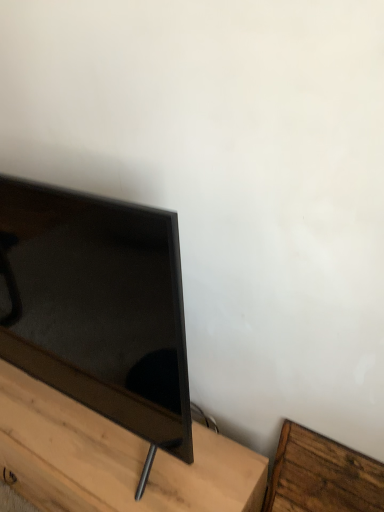
This screenshot has width=384, height=512. Describe the element at coordinates (322, 476) in the screenshot. I see `wooden bed frame at lower right, arranged as the second furniture when viewed from the left` at that location.

This screenshot has height=512, width=384. What do you see at coordinates (113, 459) in the screenshot?
I see `matte black tv stand at lower left, the 2th furniture in the right-to-left sequence` at bounding box center [113, 459].

Identify the location of matte black tv at left. This screenshot has width=384, height=512. (97, 306).

Is matte black tv at left outside of wooden bed frame at lower right, arranged as the second furniture when viewed from the left?

Absolutely, matte black tv at left is external to wooden bed frame at lower right, arranged as the second furniture when viewed from the left.

Is matte black tv at left placed right next to wooden bed frame at lower right, which is the 1th furniture from right to left?

No, matte black tv at left is not touching wooden bed frame at lower right, which is the 1th furniture from right to left.

How different are the orientations of matte black tv at left and wooden bed frame at lower right, which is the 1th furniture from right to left, in degrees?

They differ by 0.965 degrees in their facing directions.

Does matte black tv at left lie behind wooden bed frame at lower right, which is the 1th furniture from right to left?

No, the depth of matte black tv at left is less than that of wooden bed frame at lower right, which is the 1th furniture from right to left.

Based on the photo, can you tell me how much matte black tv stand at lower left, acting as the first furniture starting from the left, and matte black tv at left differ in facing direction?

The angular difference between matte black tv stand at lower left, acting as the first furniture starting from the left, and matte black tv at left is 0.0479 degrees.

Is matte black tv stand at lower left, the 2th furniture in the right-to-left sequence, situated inside matte black tv at left or outside?

matte black tv stand at lower left, the 2th furniture in the right-to-left sequence, is located beyond the bounds of matte black tv at left.

From a real-world perspective, which is physically below, matte black tv stand at lower left, acting as the first furniture starting from the left, or matte black tv at left?

matte black tv stand at lower left, acting as the first furniture starting from the left, from a real-world perspective.

Is wooden bed frame at lower right, which is the 1th furniture from right to left, not near matte black tv stand at lower left, acting as the first furniture starting from the left?

No, wooden bed frame at lower right, which is the 1th furniture from right to left, is not far away from matte black tv stand at lower left, acting as the first furniture starting from the left.

Considering the relative positions of wooden bed frame at lower right, which is the 1th furniture from right to left, and matte black tv stand at lower left, acting as the first furniture starting from the left, in the image provided, is wooden bed frame at lower right, which is the 1th furniture from right to left, to the left of matte black tv stand at lower left, acting as the first furniture starting from the left, from the viewer's perspective?

Incorrect, wooden bed frame at lower right, which is the 1th furniture from right to left, is not on the left side of matte black tv stand at lower left, acting as the first furniture starting from the left.

Is wooden bed frame at lower right, which is the 1th furniture from right to left, oriented away from matte black tv stand at lower left, acting as the first furniture starting from the left?

wooden bed frame at lower right, which is the 1th furniture from right to left, does not have its back to matte black tv stand at lower left, acting as the first furniture starting from the left.

Is wooden bed frame at lower right, arranged as the second furniture when viewed from the left, inside or outside of matte black tv stand at lower left, acting as the first furniture starting from the left?

The correct answer is: outside.

Find the location of a particular element. This screenshot has height=512, width=384. television in front of the wooden bed frame at lower right, arranged as the second furniture when viewed from the left is located at coordinates (97, 306).

Between wooden bed frame at lower right, which is the 1th furniture from right to left, and matte black tv at left, which one is positioned in front?

Positioned in front is matte black tv at left.

Is wooden bed frame at lower right, arranged as the second furniture when viewed from the left, shorter than matte black tv at left?

Yes.

From a real-world perspective, is wooden bed frame at lower right, arranged as the second furniture when viewed from the left, on top of matte black tv at left?

No.

Can you confirm if matte black tv stand at lower left, acting as the first furniture starting from the left, is taller than wooden bed frame at lower right, arranged as the second furniture when viewed from the left?

Incorrect, the height of matte black tv stand at lower left, acting as the first furniture starting from the left, is not larger of that of wooden bed frame at lower right, arranged as the second furniture when viewed from the left.

Is matte black tv stand at lower left, the 2th furniture in the right-to-left sequence, not inside wooden bed frame at lower right, which is the 1th furniture from right to left?

That's correct, matte black tv stand at lower left, the 2th furniture in the right-to-left sequence, is outside of wooden bed frame at lower right, which is the 1th furniture from right to left.

From the image's perspective, does matte black tv stand at lower left, the 2th furniture in the right-to-left sequence, appear lower than wooden bed frame at lower right, arranged as the second furniture when viewed from the left?

No, from the image's perspective, matte black tv stand at lower left, the 2th furniture in the right-to-left sequence, is not below wooden bed frame at lower right, arranged as the second furniture when viewed from the left.

What's the angular difference between matte black tv stand at lower left, the 2th furniture in the right-to-left sequence, and wooden bed frame at lower right, which is the 1th furniture from right to left,'s facing directions?

The angular difference between matte black tv stand at lower left, the 2th furniture in the right-to-left sequence, and wooden bed frame at lower right, which is the 1th furniture from right to left, is 0.917 degrees.

Is matte black tv at left wider or thinner than matte black tv stand at lower left, the 2th furniture in the right-to-left sequence?

In the image, matte black tv at left appears to be more narrow than matte black tv stand at lower left, the 2th furniture in the right-to-left sequence.

Is point (97, 219) closer or farther from the camera than point (226, 470)?

Point (97, 219) appears to be closer to the viewer than point (226, 470).

Can matte black tv stand at lower left, the 2th furniture in the right-to-left sequence, be found inside matte black tv at left?

Actually, matte black tv stand at lower left, the 2th furniture in the right-to-left sequence, is outside matte black tv at left.

What are the coordinates of `the 2nd furniture behind the matte black tv at left` in the screenshot? It's located at (322, 476).

In the image, there is a matte black tv stand at lower left, acting as the first furniture starting from the left. Where is `television above it (from the image's perspective)`? television above it (from the image's perspective) is located at coordinates (97, 306).

Considering their positions, is matte black tv stand at lower left, the 2th furniture in the right-to-left sequence, positioned closer to wooden bed frame at lower right, arranged as the second furniture when viewed from the left, than matte black tv at left?

matte black tv stand at lower left, the 2th furniture in the right-to-left sequence.

Consider the image. Looking at the image, which one is located closer to matte black tv at left, wooden bed frame at lower right, arranged as the second furniture when viewed from the left, or matte black tv stand at lower left, the 2th furniture in the right-to-left sequence?

matte black tv stand at lower left, the 2th furniture in the right-to-left sequence, is closer to matte black tv at left.

Which object lies further to the anchor point matte black tv stand at lower left, acting as the first furniture starting from the left, wooden bed frame at lower right, arranged as the second furniture when viewed from the left, or matte black tv at left?

Among the two, wooden bed frame at lower right, arranged as the second furniture when viewed from the left, is located further to matte black tv stand at lower left, acting as the first furniture starting from the left.

Which object lies further to the anchor point matte black tv stand at lower left, the 2th furniture in the right-to-left sequence, matte black tv at left or wooden bed frame at lower right, which is the 1th furniture from right to left?

wooden bed frame at lower right, which is the 1th furniture from right to left, lies further to matte black tv stand at lower left, the 2th furniture in the right-to-left sequence, than the other object.

Based on their spatial positions, is matte black tv at left or matte black tv stand at lower left, acting as the first furniture starting from the left, closer to wooden bed frame at lower right, arranged as the second furniture when viewed from the left?

matte black tv stand at lower left, acting as the first furniture starting from the left, lies closer to wooden bed frame at lower right, arranged as the second furniture when viewed from the left, than the other object.

Based on their spatial positions, is matte black tv stand at lower left, acting as the first furniture starting from the left, or wooden bed frame at lower right, which is the 1th furniture from right to left, further from matte black tv at left?

wooden bed frame at lower right, which is the 1th furniture from right to left, is positioned further to the anchor matte black tv at left.

This screenshot has width=384, height=512. In order to click on television between matte black tv stand at lower left, the 2th furniture in the right-to-left sequence, and wooden bed frame at lower right, arranged as the second furniture when viewed from the left, in the horizontal direction in this screenshot , I will do `click(97, 306)`.